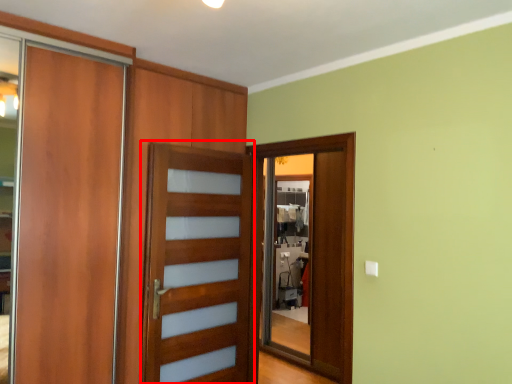
Question: From the image's perspective, where is screen door (annotated by the red box) located in relation to screen door in the image?

Choices:
 (A) below
 (B) above

Answer: (A)